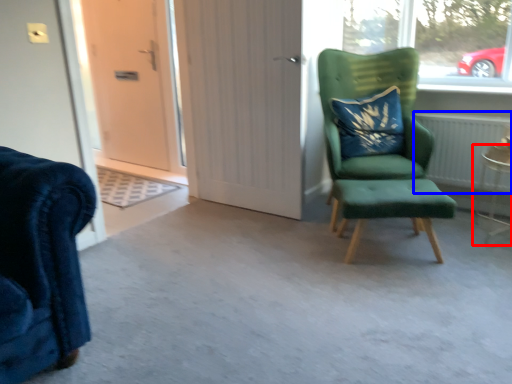
Question: Which object is closer to the camera taking this photo, side table (highlighted by a red box) or radiator (highlighted by a blue box)?

Choices:
 (A) side table
 (B) radiator

Answer: (A)